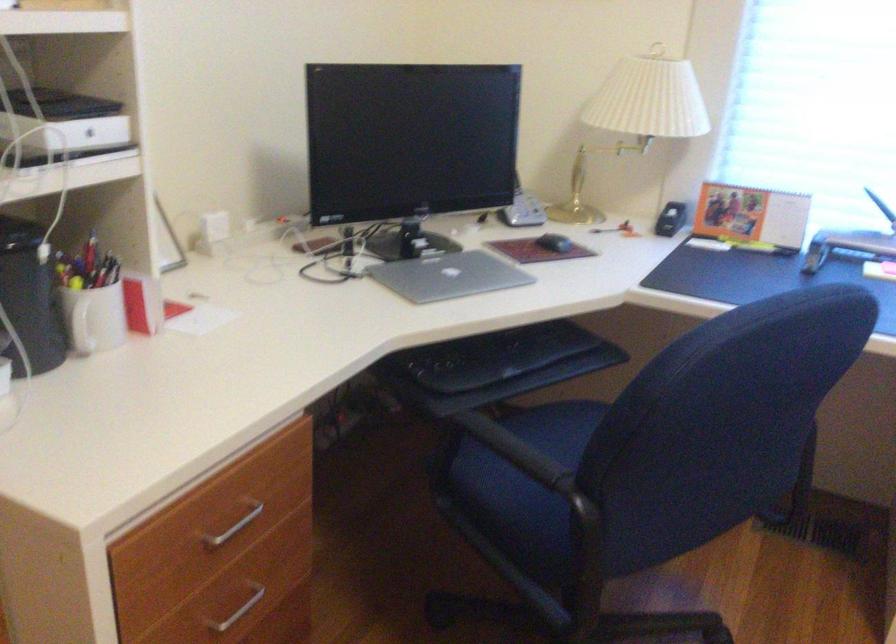
The location [554,243] corresponds to which object?

It corresponds to the black computer mouse in the image.